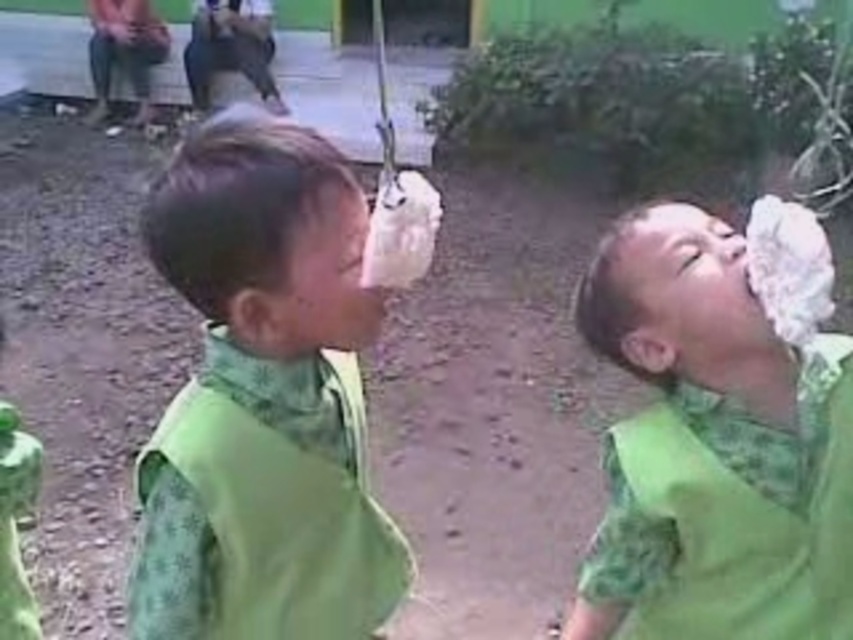
You are a photographer trying to capture a clear shot of the green fabric bib at center and the green fabric shirt at center. Since both are green, you need to adjust your focus based on their sizes. Which object should you focus on first if you want to ensure the larger object is in focus?

The green fabric bib at center has a greater height compared to the green fabric shirt at center, so you should focus on the green fabric bib at center first to ensure the larger object is in focus.

You are a photographer standing 40 inches away from the green fabric bib at center. Can you reach it without moving your feet?

The green fabric bib at center is 38.67 inches away from the viewer. Since you are standing 40 inches away, you cannot reach it without moving closer.